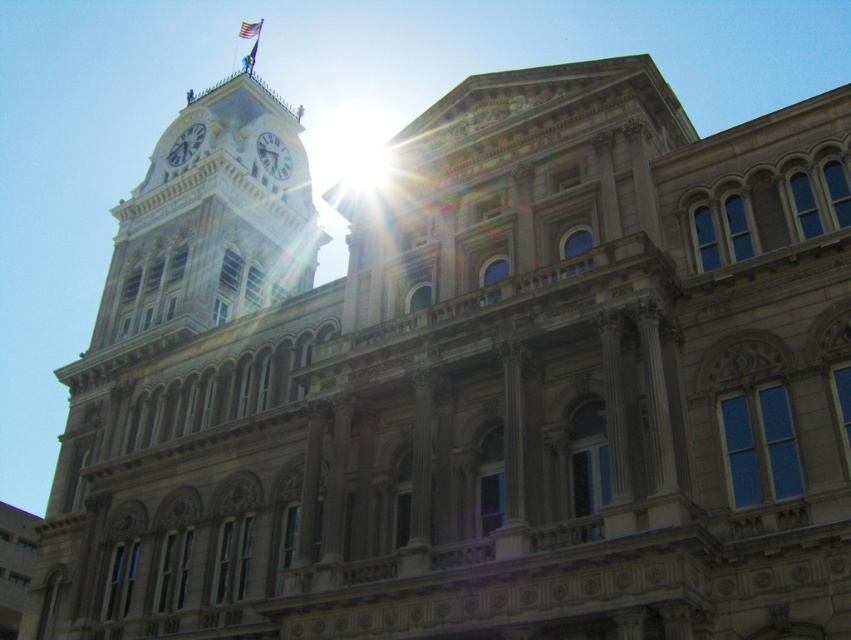
Question: Can you confirm if white glossy clock at upper left is smaller than american flag at upper center?

Choices:
 (A) yes
 (B) no

Answer: (A)

Question: Does white marble clock at upper center have a lesser width compared to white glossy clock at upper left?

Choices:
 (A) yes
 (B) no

Answer: (A)

Question: Which point is farther to the camera?

Choices:
 (A) white glossy clock at upper left
 (B) american flag at upper center
 (C) white marble clock at upper center

Answer: (B)

Question: Which object is positioned farthest from the white marble clock at upper center?

Choices:
 (A) american flag at upper center
 (B) white glossy clock at upper left

Answer: (A)

Question: Among these points, which one is farthest from the camera?

Choices:
 (A) (186, 131)
 (B) (261, 136)

Answer: (A)

Question: Does white glossy clock at upper left come behind american flag at upper center?

Choices:
 (A) no
 (B) yes

Answer: (A)